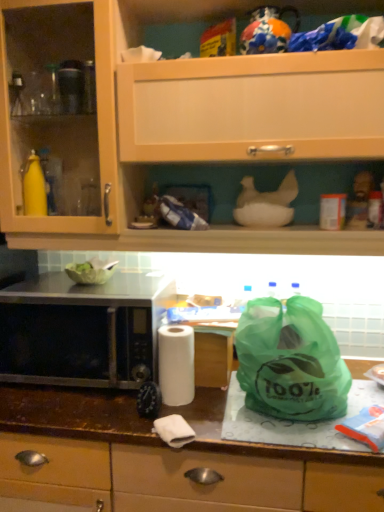
You are a GUI agent. You are given a task and a screenshot of the screen. Output one action in this format:
    pyautogui.click(x=<x>, y=<y>)
    Task: Click on the vacant point above black matte microwave at left (from a real-world perspective)
    The width and height of the screenshot is (384, 512).
    Given the screenshot: What is the action you would take?
    pyautogui.click(x=84, y=287)